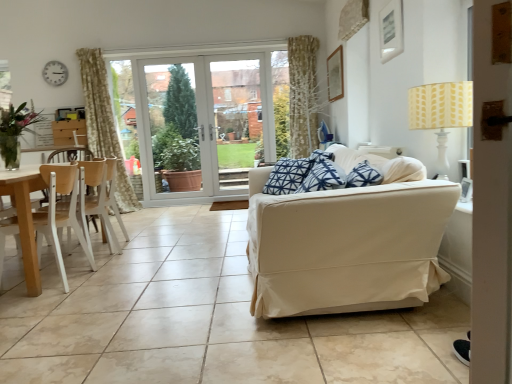
Where is `free location to the right of light wood/wooden chair at left, positioned as the 1th chair in front-to-back order`? This screenshot has width=512, height=384. free location to the right of light wood/wooden chair at left, positioned as the 1th chair in front-to-back order is located at coordinates [x=111, y=279].